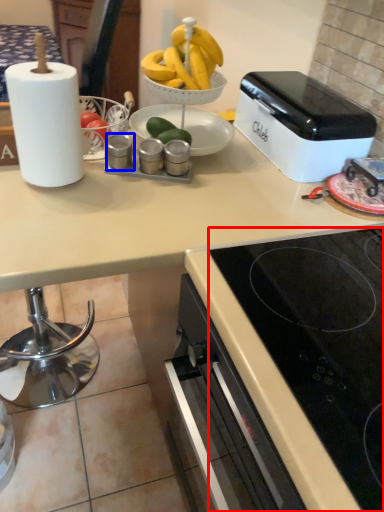
Question: Which object is closer to the camera taking this photo, gas stove (highlighted by a red box) or appliance (highlighted by a blue box)?

Choices:
 (A) gas stove
 (B) appliance

Answer: (A)